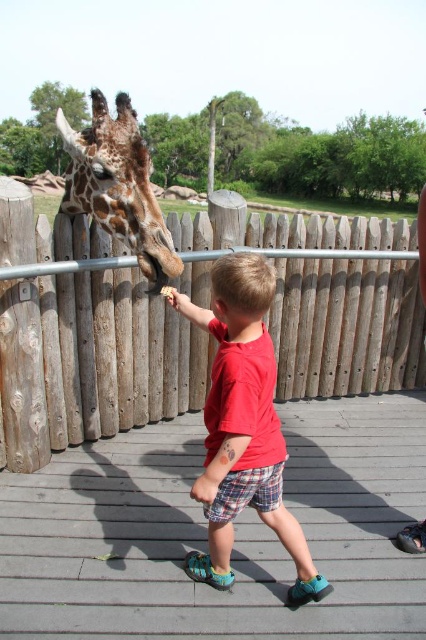
Question: Which of the following is the farthest from the observer?

Choices:
 (A) (109, 154)
 (B) (117, 289)

Answer: (B)

Question: Among these points, which one is farthest from the camera?

Choices:
 (A) (221, 484)
 (B) (144, 186)

Answer: (B)

Question: In this image, where is red cotton shirt at center located relative to spotted fur giraffe at center?

Choices:
 (A) right
 (B) left

Answer: (A)

Question: In this image, where is wooden fence at center located relative to spotted fur giraffe at center?

Choices:
 (A) right
 (B) left

Answer: (A)

Question: Which point is closer to the camera?

Choices:
 (A) (86, 208)
 (B) (14, 355)
 (C) (236, 253)

Answer: (C)

Question: Does wooden fence at center appear on the left side of spotted fur giraffe at center?

Choices:
 (A) no
 (B) yes

Answer: (A)